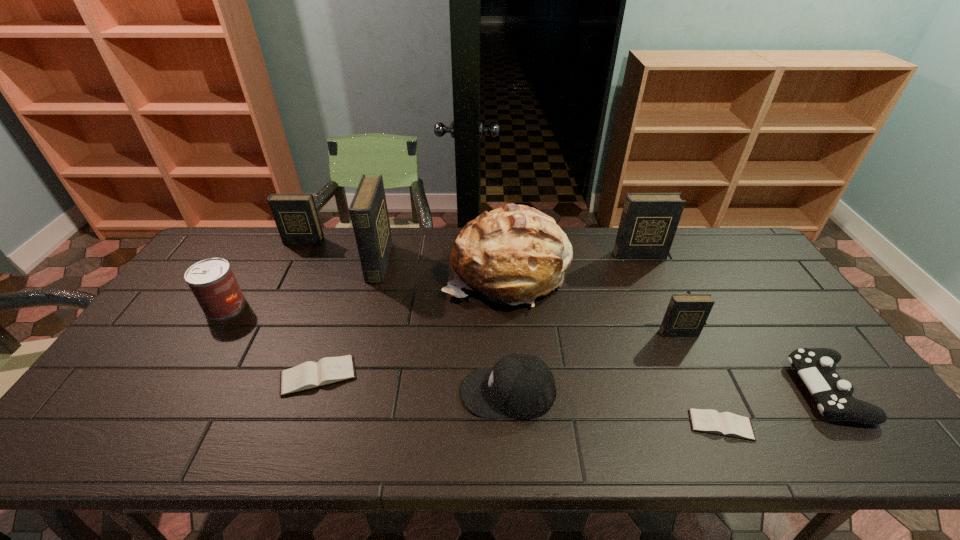
Locate an element on the screen. The image size is (960, 540). blank space at the right edge is located at coordinates (747, 281).

This screenshot has height=540, width=960. Identify the location of blank space at the far left corner. (226, 238).

In the image, there is a desktop. At what (x,y) coordinates should I click in order to perform the action: click on free region at the far right corner. Please return your answer as a coordinate pair (x, y). Image resolution: width=960 pixels, height=540 pixels. Looking at the image, I should click on (728, 267).

The height and width of the screenshot is (540, 960). What are the coordinates of `vacant space that's between the leftmost object and the second smallest dark diary` in the screenshot? It's located at (264, 274).

You are a GUI agent. You are given a task and a screenshot of the screen. Output one action in this format:
    pyautogui.click(x=<x>, y=<y>)
    Task: Click on the empty location between the shortest diary and the biggest dark diary
    This screenshot has width=960, height=540.
    Given the screenshot: What is the action you would take?
    pyautogui.click(x=550, y=344)

Where is `empty location between the eighth tallest object and the fifth shortest diary`? The height and width of the screenshot is (540, 960). empty location between the eighth tallest object and the fifth shortest diary is located at coordinates (732, 322).

This screenshot has height=540, width=960. I want to click on free space between the cap and the nearer brown diary, so click(x=614, y=408).

The height and width of the screenshot is (540, 960). What are the coordinates of `free space between the third tallest diary and the nearer brown diary` in the screenshot? It's located at [512, 333].

The width and height of the screenshot is (960, 540). I want to click on free space that is in between the nearer brown diary and the third smallest dark diary, so click(x=680, y=340).

Where is `empty location between the bread and the shortest object`? Image resolution: width=960 pixels, height=540 pixels. empty location between the bread and the shortest object is located at coordinates (614, 348).